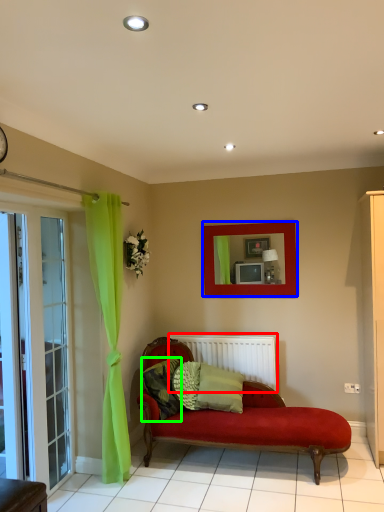
Question: Estimate the real-world distances between objects in this image. Which object is farther from radiator (highlighted by a red box), picture frame (highlighted by a blue box) or pillow (highlighted by a green box)?

Choices:
 (A) picture frame
 (B) pillow

Answer: (A)